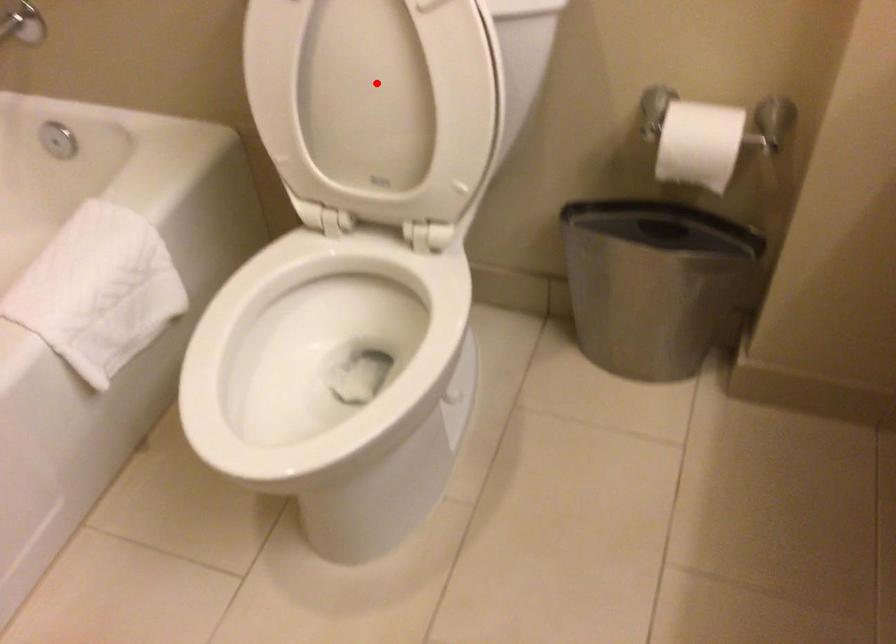
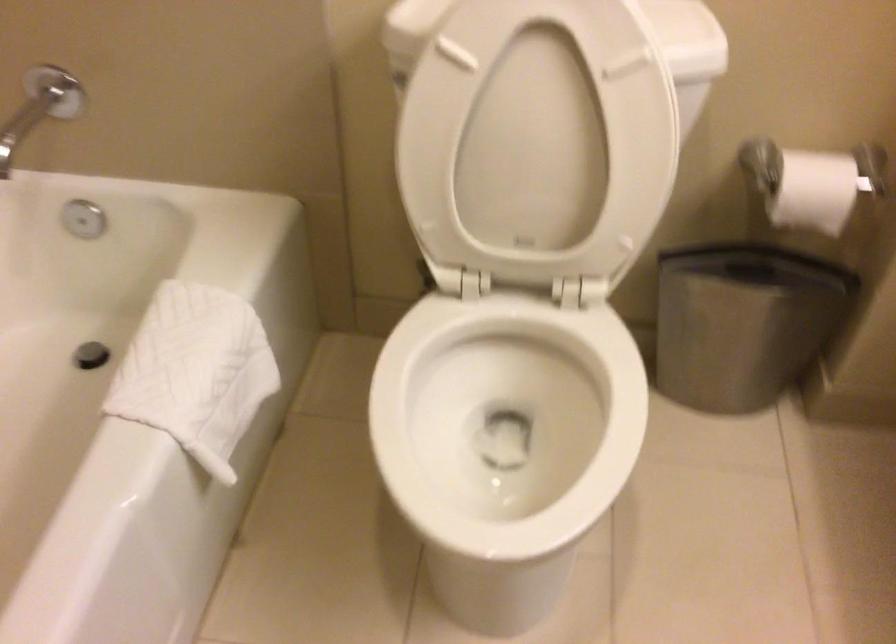
Find the pixel in the second image that matches the highlighted location in the first image.

(538, 140)